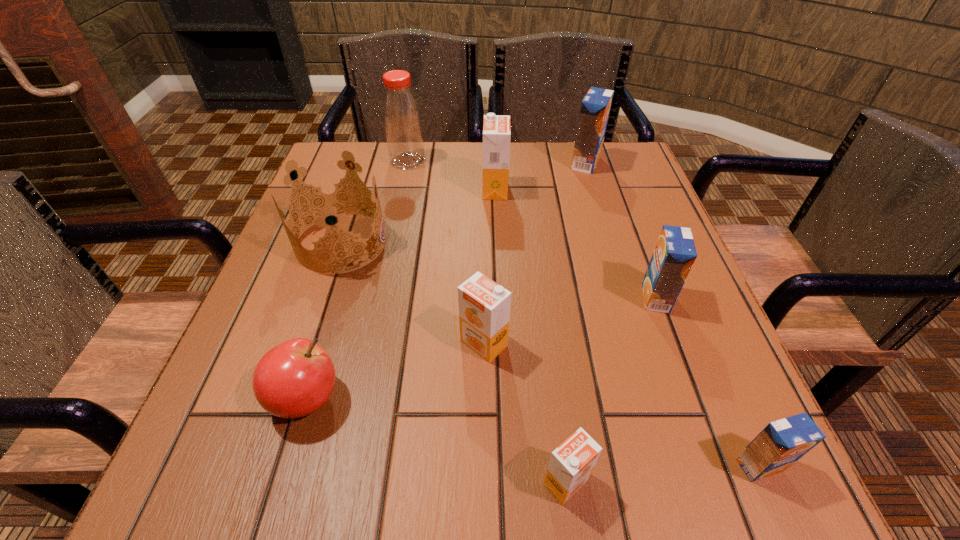
The height and width of the screenshot is (540, 960). What are the coordinates of `the fourth nearest object` in the screenshot? It's located at (484, 306).

You are a GUI agent. You are given a task and a screenshot of the screen. Output one action in this format:
    pyautogui.click(x=<x>, y=<y>)
    Task: Click on the red apple
    This screenshot has width=960, height=540.
    Given the screenshot: What is the action you would take?
    pyautogui.click(x=295, y=378)

The height and width of the screenshot is (540, 960). I want to click on apple, so (295, 378).

I want to click on the smallest blue orange_juice, so click(781, 443).

What are the coordinates of `the fourth object from right to left` in the screenshot? It's located at click(x=571, y=464).

Locate an element on the screen. This screenshot has height=540, width=960. the third orange juice from left to right is located at coordinates point(571,464).

Find the location of a particular element. free space located 0.350m on the right of the red bottle is located at coordinates (558, 161).

At what (x,y) coordinates should I click in order to perform the action: click on free space located 0.130m on the left of the biggest blue orange_juice. Please return your answer as a coordinate pair (x, y). Looking at the image, I should click on (519, 163).

You are a GUI agent. You are given a task and a screenshot of the screen. Output one action in this format:
    pyautogui.click(x=<x>, y=<y>)
    Task: Click on the vacant space located 0.260m on the right of the second farthest orange juice
    
    Given the screenshot: What is the action you would take?
    pyautogui.click(x=614, y=190)

Identify the location of vacant space located on the right of the crown. (532, 242).